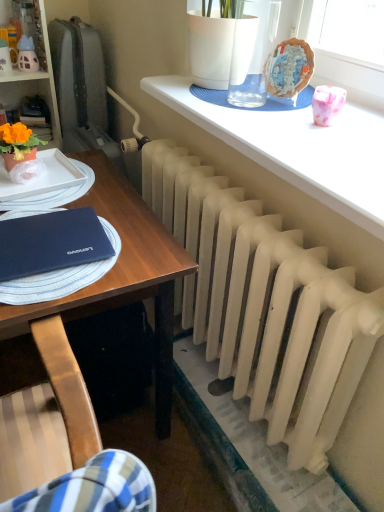
Question: Is white matte desk at center not inside matte black notebook at left?

Choices:
 (A) no
 (B) yes

Answer: (B)

Question: Can you confirm if white matte desk at center is bigger than matte black notebook at left?

Choices:
 (A) yes
 (B) no

Answer: (A)

Question: Is white matte desk at center facing away from matte black notebook at left?

Choices:
 (A) no
 (B) yes

Answer: (A)

Question: From a real-world perspective, does white matte desk at center stand above matte black notebook at left?

Choices:
 (A) yes
 (B) no

Answer: (B)

Question: Does white matte desk at center turn towards matte black notebook at left?

Choices:
 (A) no
 (B) yes

Answer: (A)

Question: Considering the positions of orange matte flower pot at left and white matte radiator at upper center in the image, is orange matte flower pot at left bigger or smaller than white matte radiator at upper center?

Choices:
 (A) big
 (B) small

Answer: (B)

Question: Considering the positions of point (18, 148) and point (140, 86), is point (18, 148) closer or farther from the camera than point (140, 86)?

Choices:
 (A) closer
 (B) farther

Answer: (A)

Question: In the image, is orange matte flower pot at left on the left side or the right side of white matte radiator at upper center?

Choices:
 (A) right
 (B) left

Answer: (B)

Question: Is orange matte flower pot at left spatially inside white matte radiator at upper center, or outside of it?

Choices:
 (A) outside
 (B) inside

Answer: (A)

Question: From a real-world perspective, is matte orange flower pot at left above or below fluffy fabric flower at upper center?

Choices:
 (A) below
 (B) above

Answer: (A)

Question: Is point (59, 132) closer or farther from the camera than point (291, 37)?

Choices:
 (A) closer
 (B) farther

Answer: (B)

Question: From the image's perspective, relative to fluffy fabric flower at upper center, is matte orange flower pot at left above or below?

Choices:
 (A) below
 (B) above

Answer: (B)

Question: Is matte orange flower pot at left wider or thinner than fluffy fabric flower at upper center?

Choices:
 (A) thin
 (B) wide

Answer: (B)

Question: In terms of size, does white matte radiator at upper center appear bigger or smaller than orange matte flower pot at left?

Choices:
 (A) big
 (B) small

Answer: (A)

Question: Does point (375, 129) appear closer or farther from the camera than point (26, 159)?

Choices:
 (A) farther
 (B) closer

Answer: (B)